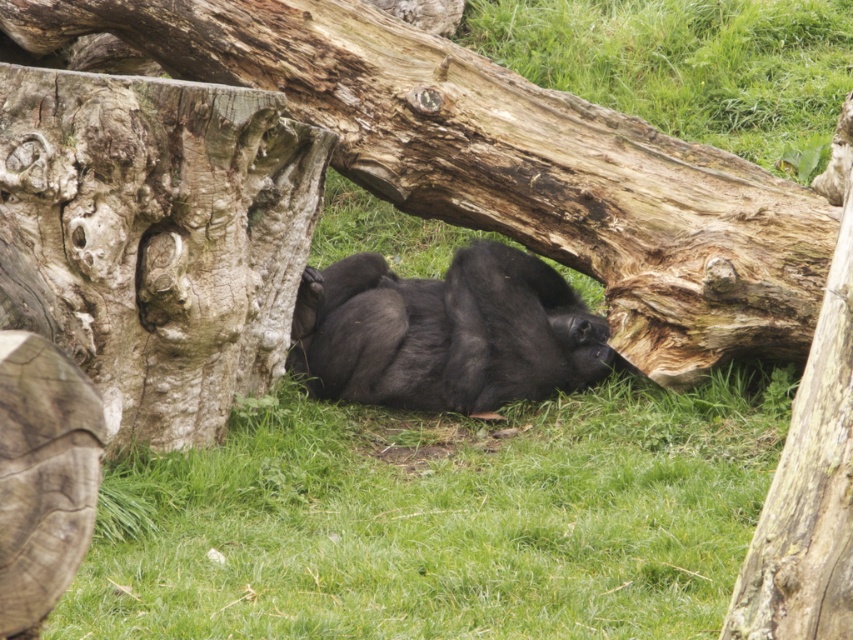
You are a wildlife photographer aiming to capture the gorilla in the scene. To ensure the rough bark tree trunk at left is included in your shot, where should you position your camera relative to the gorilla?

The rough bark tree trunk at left is located at point (x=155, y=237), so you should position your camera to the left side of the gorilla to include it in the shot.

You are a photographer trying to capture the smooth brown log at center without the green grass at lower center blocking it. What adjustment should you make to your camera angle?

To avoid the green grass at lower center blocking the smooth brown log at center, you should adjust your camera angle to a higher position, as the green grass at lower center is in front of the smooth brown log at center and would obstruct the view from a lower angle.

You are a wildlife photographer trying to capture a photo of the black fur gorilla at center. You notice there is a rough bark tree trunk at left in the frame. Which object is larger in size?

The rough bark tree trunk at left is bigger than the black fur gorilla at center, so the rough bark tree trunk at left is larger in size.